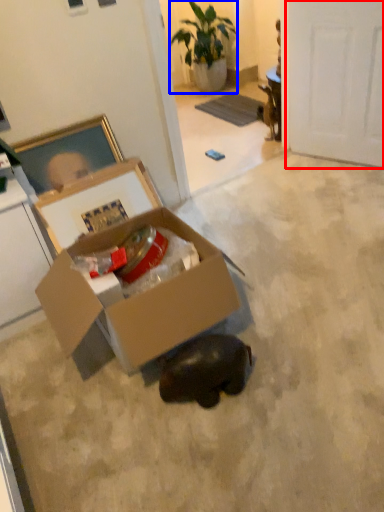
Question: Which point is further to the camera, door (highlighted by a red box) or houseplant (highlighted by a blue box)?

Choices:
 (A) door
 (B) houseplant

Answer: (B)